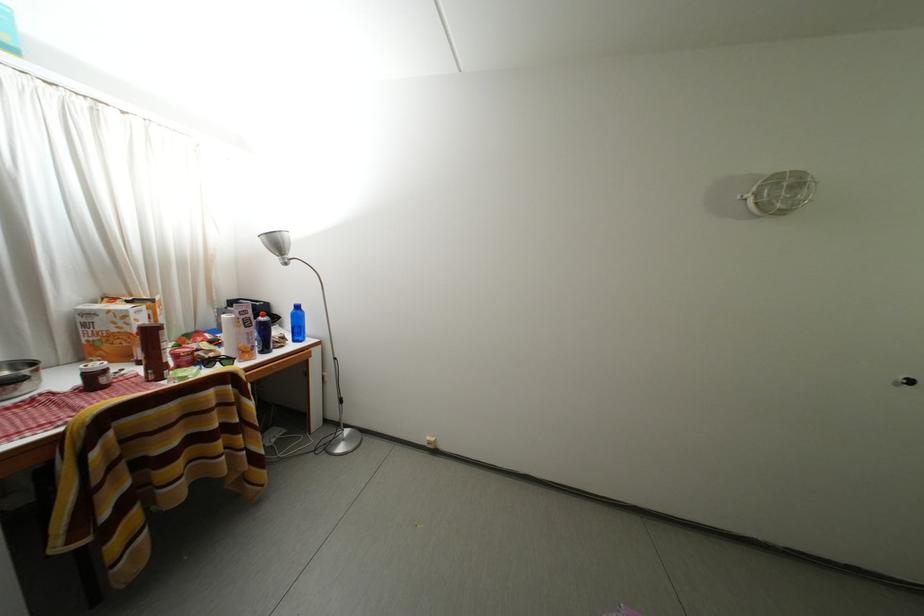
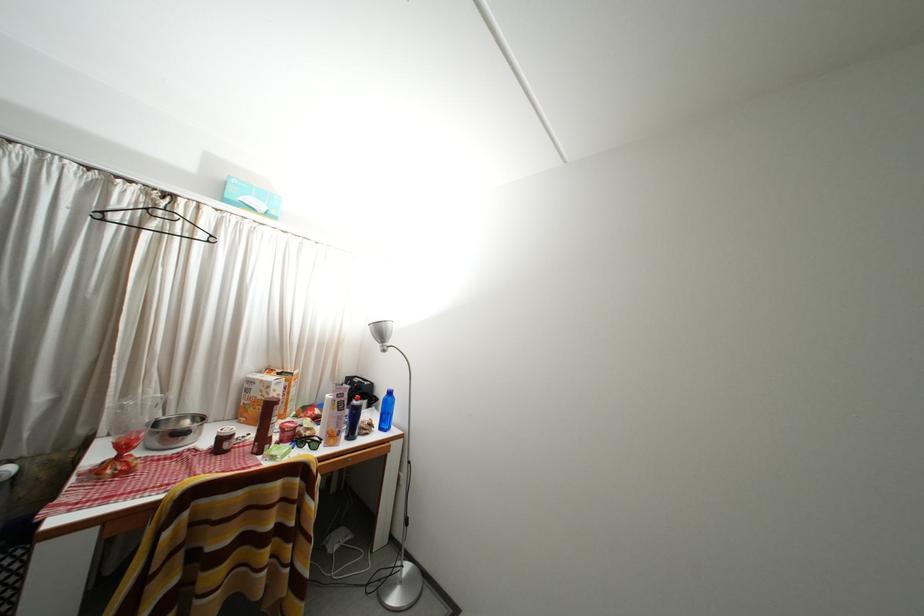
Find the pixel in the second image that matches point (179, 370) in the first image.

(284, 444)